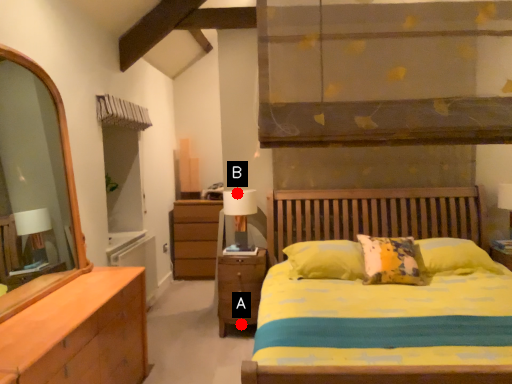
Question: Two points are circled on the image, labeled by A and B beside each circle. Which point appears closest to the camera in this image?

Choices:
 (A) A is closer
 (B) B is closer

Answer: (B)